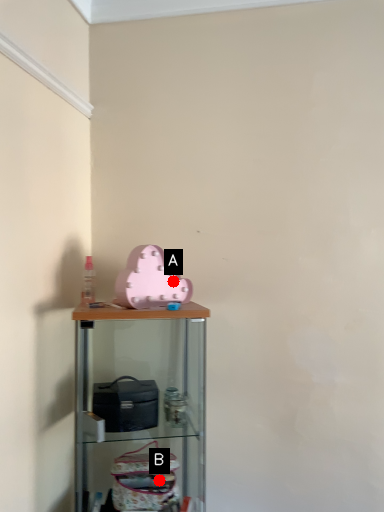
Question: Two points are circled on the image, labeled by A and B beside each circle. Which point appears closest to the camera in this image?

Choices:
 (A) A is closer
 (B) B is closer

Answer: (B)